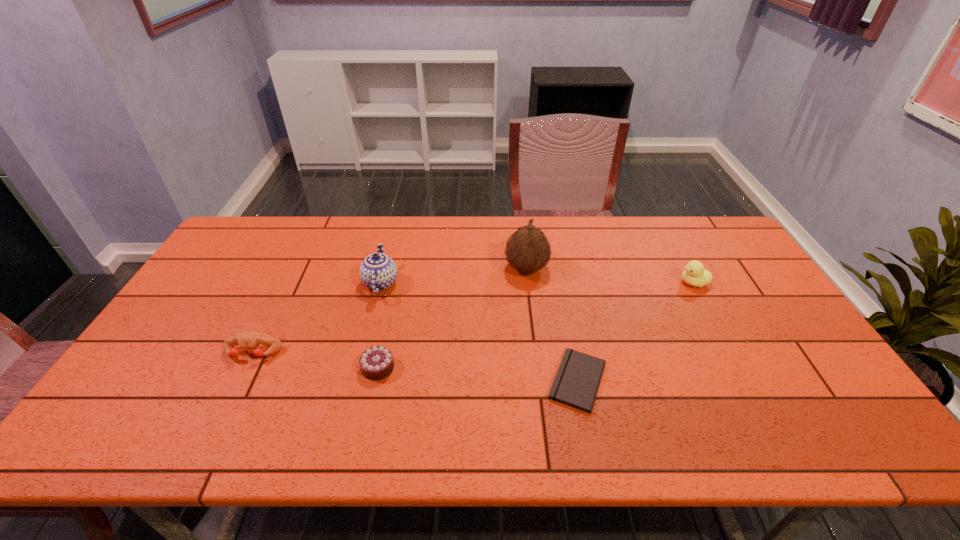
Locate an element on the screen. coconut is located at coordinates (528, 250).

The height and width of the screenshot is (540, 960). Identify the location of chinaware. (378, 272).

The height and width of the screenshot is (540, 960). What are the coordinates of `the rightmost object` in the screenshot? It's located at (694, 274).

This screenshot has height=540, width=960. Find the location of `the fourth shortest object`. the fourth shortest object is located at coordinates (694, 274).

I want to click on puncher, so click(x=250, y=341).

This screenshot has width=960, height=540. What are the coordinates of `chocolate cake` in the screenshot? It's located at (376, 363).

This screenshot has height=540, width=960. Find the location of `the shortest object`. the shortest object is located at coordinates (576, 383).

This screenshot has width=960, height=540. I want to click on blank area located 0.340m on the surface of the tallest object, so click(399, 268).

You are a GUI agent. You are given a task and a screenshot of the screen. Output one action in this format:
    pyautogui.click(x=<x>, y=<y>)
    Task: Click on the free space located on the surface of the tallest object
    The height and width of the screenshot is (540, 960).
    Given the screenshot: What is the action you would take?
    pyautogui.click(x=393, y=268)

At what (x,y) coordinates should I click in order to perform the action: click on free region located 0.160m on the surface of the tallest object. Please return your answer as a coordinate pair (x, y). Looking at the image, I should click on (454, 268).